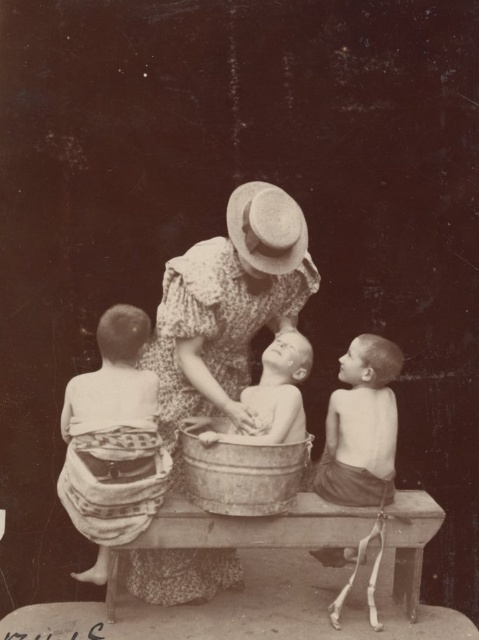
You are a photographer analyzing this vintage image. You notice the floral fabric dress at center and the smooth skin boy at right. Which object is taller in the image?

The floral fabric dress at center is taller than the smooth skin boy at right.

You are a photographer analyzing this vintage image. You notice the floral fabric dress at center and the straw hat at center. Based on their positions, which object is closer to the left edge of the photograph?

The floral fabric dress at center is positioned to the left of the straw hat at center, so it is closer to the left edge of the photograph.